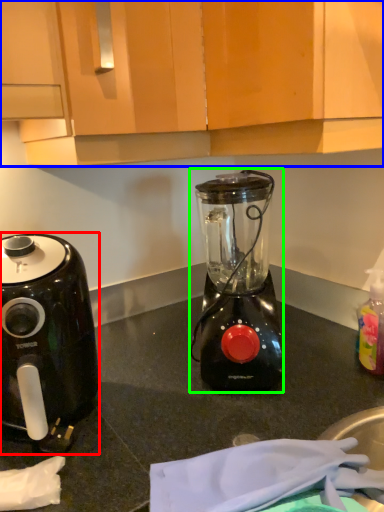
Question: Based on their relative distances, which object is nearer to coffee maker (highlighted by a red box)? Choose from cabinetry (highlighted by a blue box) and blender (highlighted by a green box).

Choices:
 (A) cabinetry
 (B) blender

Answer: (B)